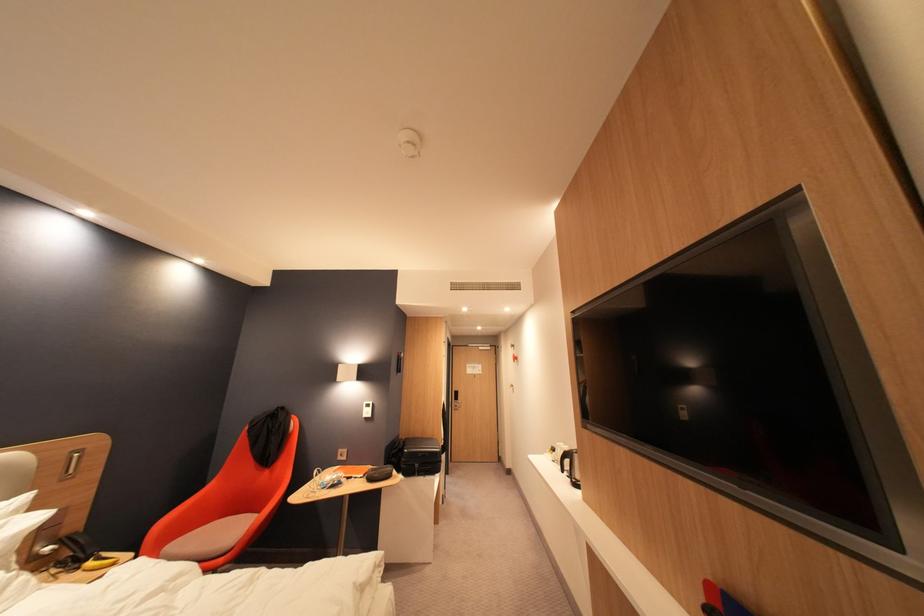
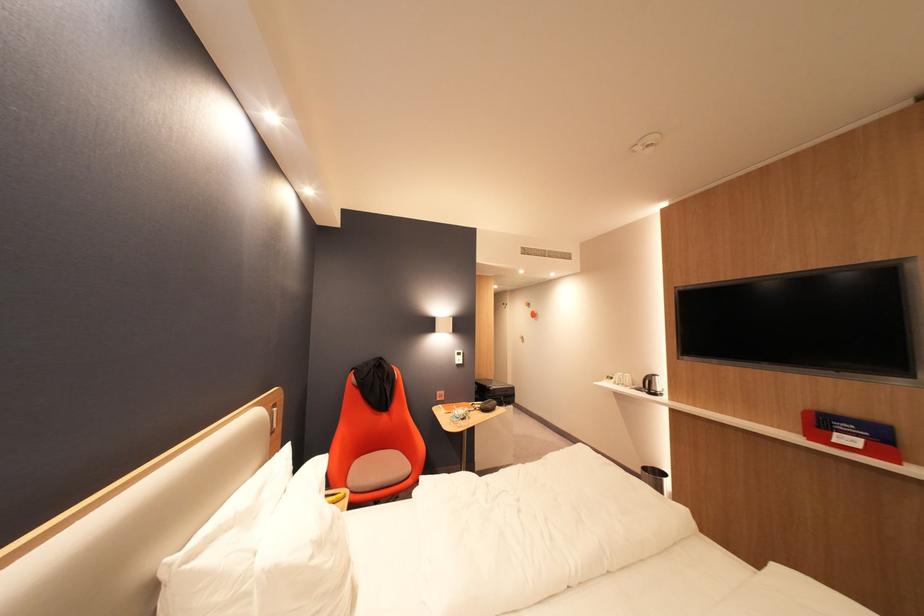
Question: Which direction would the cameraman need to move to produce the second image? Reply with the corresponding letter.

Choices:
 (A) Left
 (B) Right
 (C) Forward
 (D) Backward

Answer: (A)